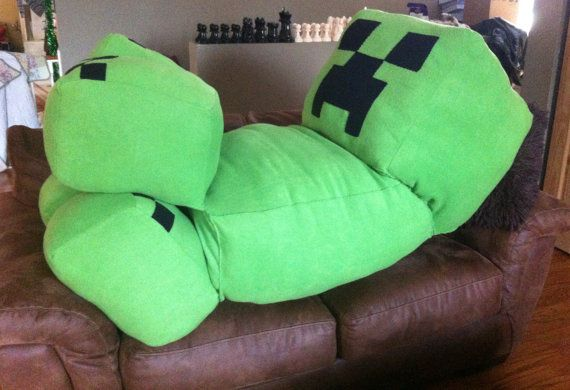
Where is `couch cushions`? Image resolution: width=570 pixels, height=390 pixels. couch cushions is located at coordinates (411, 287), (236, 325).